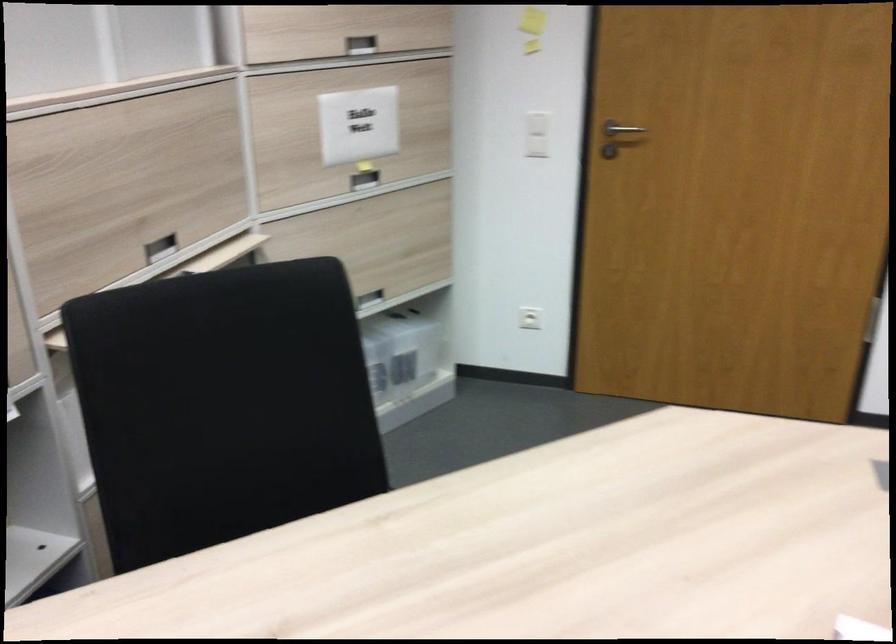
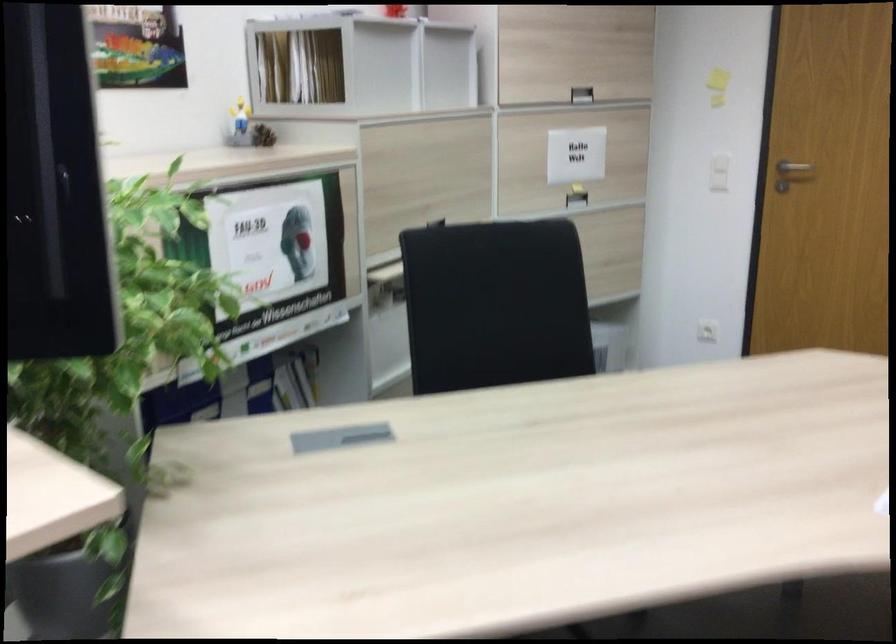
Question: The camera is either moving clockwise (left) or counter-clockwise (right) around the object. The first image is from the beginning of the video and the second image is from the end. Is the camera moving left or right when shooting the video?

Choices:
 (A) Left
 (B) Right

Answer: (B)